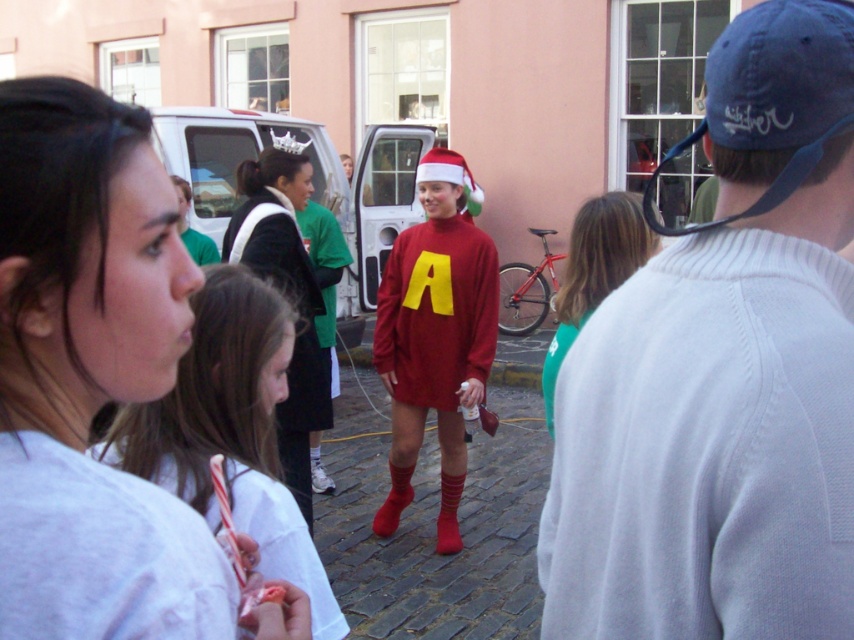
Who is positioned more to the right, white matte shirt at lower left or velvet black dress at center?

From the viewer's perspective, white matte shirt at lower left appears more on the right side.

Who is more distant from viewer, (284, 570) or (313, 524)?

Positioned behind is point (313, 524).

Between point (290, 547) and point (279, 408), which one is positioned in front?

Point (290, 547)

In order to click on white matte shirt at lower left in this screenshot , I will do `click(230, 429)`.

Is matte red sweater at center above velvet black dress at center?

No.

Is point (443, 532) positioned before point (284, 154)?

No.

Does point (458, 392) come farther from viewer compared to point (313, 381)?

Yes, point (458, 392) is farther from viewer.

Identify the location of matte red sweater at center. (436, 337).

Does white matte shirt at lower left have a greater width compared to matte red sweater at center?

No, white matte shirt at lower left is not wider than matte red sweater at center.

Between point (273, 324) and point (422, 314), which one is positioned in front?

Point (273, 324)

At what (x,y) coordinates should I click in order to perform the action: click on white matte shirt at lower left. Please return your answer as a coordinate pair (x, y). The width and height of the screenshot is (854, 640). Looking at the image, I should click on (230, 429).

The width and height of the screenshot is (854, 640). In order to click on white matte shirt at lower left in this screenshot , I will do `click(230, 429)`.